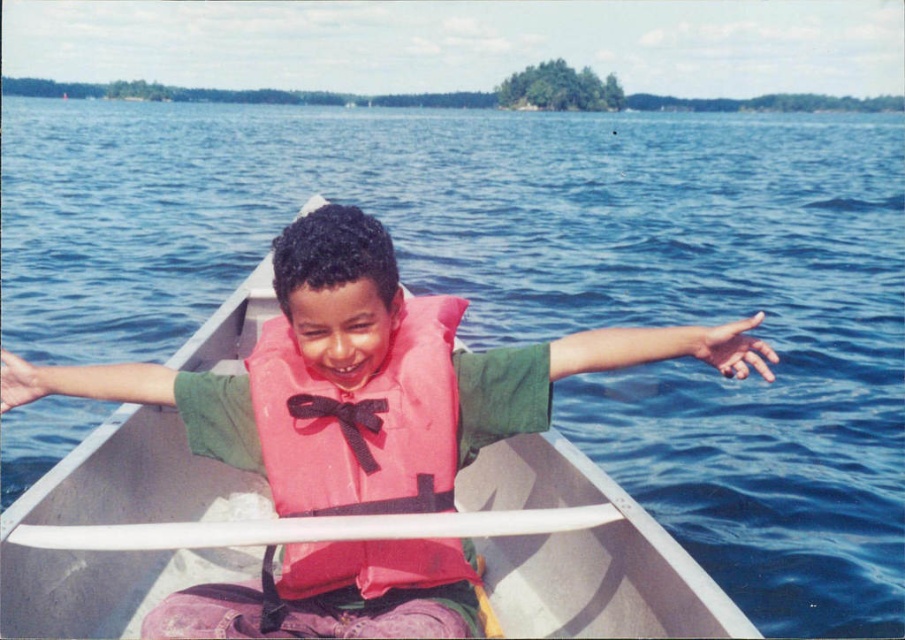
Question: Is white plastic paddle at center smaller than black satin bow tie at center?

Choices:
 (A) no
 (B) yes

Answer: (A)

Question: Which point appears farthest from the camera in this image?

Choices:
 (A) (248, 529)
 (B) (203, 448)
 (C) (434, 412)

Answer: (B)

Question: Which of the following is the closest to the observer?

Choices:
 (A) (176, 524)
 (B) (338, 422)

Answer: (B)

Question: Can you confirm if pink fabric life jacket at center is positioned to the left of black satin bow tie at center?

Choices:
 (A) no
 (B) yes

Answer: (A)

Question: Is pink fabric life vest at center closer to camera compared to pink fabric life jacket at center?

Choices:
 (A) no
 (B) yes

Answer: (B)

Question: Which of the following is the farthest from the observer?

Choices:
 (A) (191, 349)
 (B) (26, 528)

Answer: (A)